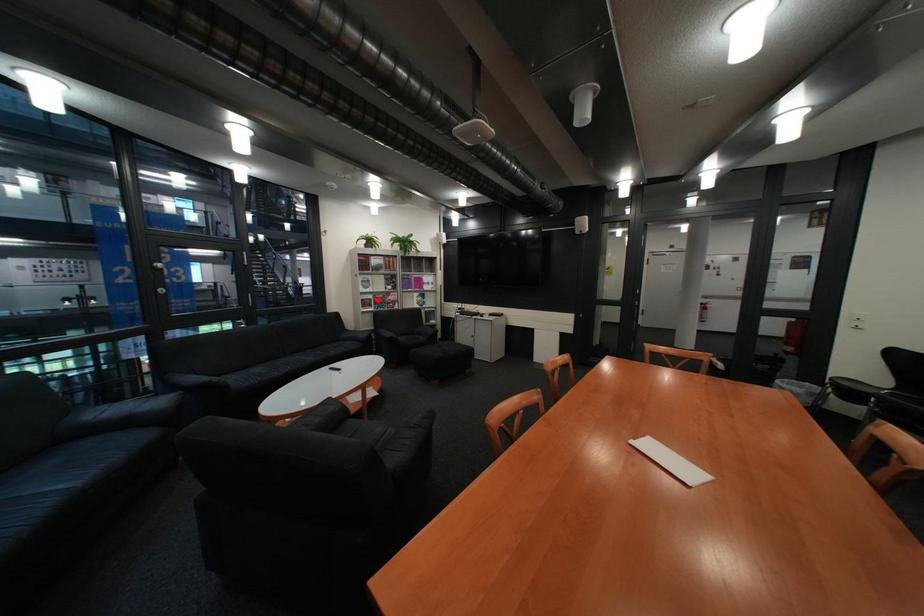
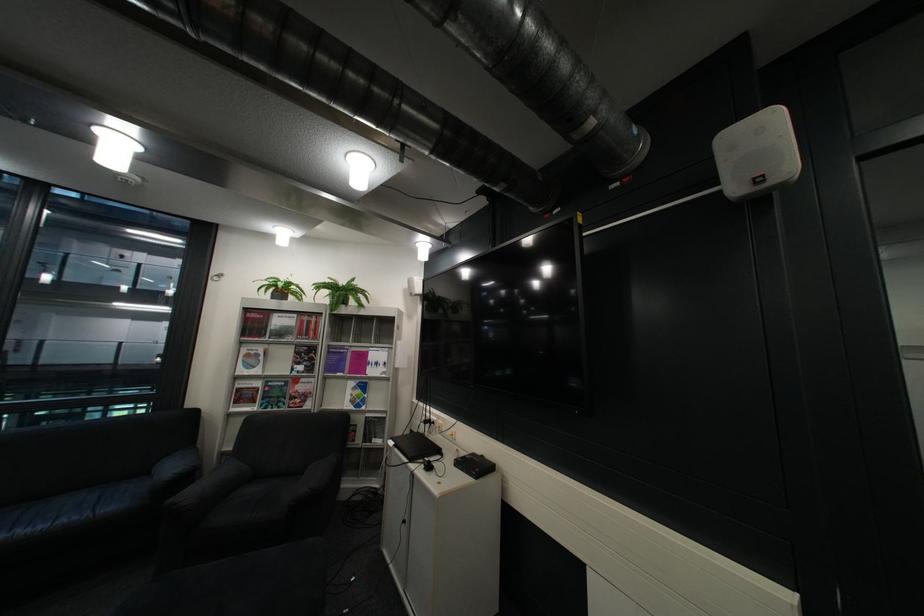
Locate, in the second image, the point that corresponds to the highlighted location in the first image.

(254, 390)